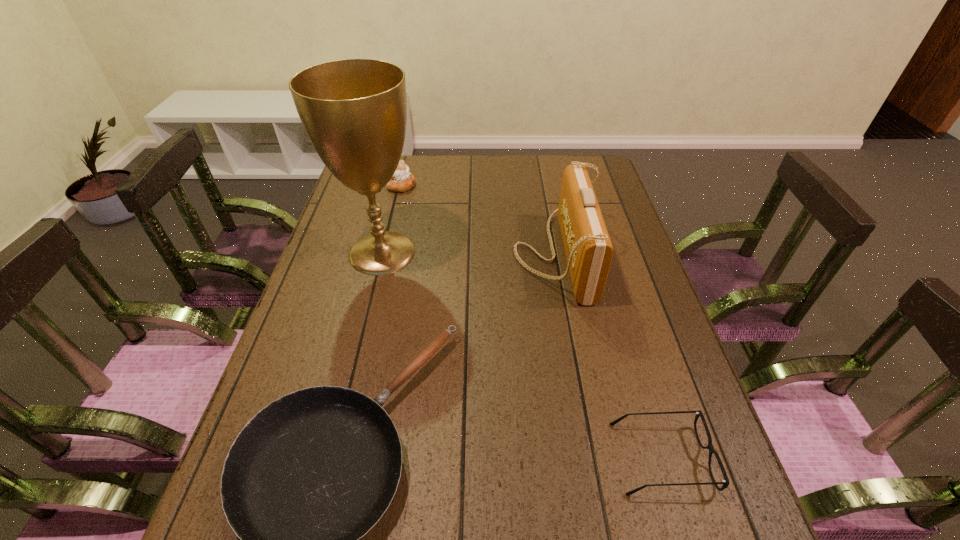
At what (x,y) coordinates should I click in order to perform the action: click on blank area located 0.270m with the lenses facing outward on the spectacles. Please return your answer as a coordinate pair (x, y). Looking at the image, I should click on (477, 458).

Where is `vacant space located 0.330m with the lenses facing outward on the spectacles`? This screenshot has height=540, width=960. vacant space located 0.330m with the lenses facing outward on the spectacles is located at coordinates (446, 458).

Identify the location of free point located with the lenses facing outward on the spectacles. (575, 458).

Identify the location of object that is at the far edge. This screenshot has height=540, width=960. (402, 180).

Where is `trophy cup that is at the left edge`? The width and height of the screenshot is (960, 540). trophy cup that is at the left edge is located at coordinates (354, 111).

You are a GUI agent. You are given a task and a screenshot of the screen. Output one action in this format:
    pyautogui.click(x=<x>, y=<y>)
    Task: Click on the pastry positioned at the left edge
    The width and height of the screenshot is (960, 540).
    Given the screenshot: What is the action you would take?
    pyautogui.click(x=402, y=180)

Locate an element on the screen. handbag located in the right edge section of the desktop is located at coordinates (588, 248).

Image resolution: width=960 pixels, height=540 pixels. I want to click on spectacles positioned at the right edge, so click(x=725, y=482).

This screenshot has width=960, height=540. What are the coordinates of `object located at the far left corner` in the screenshot? It's located at coord(402,180).

In order to click on vacant space at the far edge in this screenshot , I will do `click(422, 185)`.